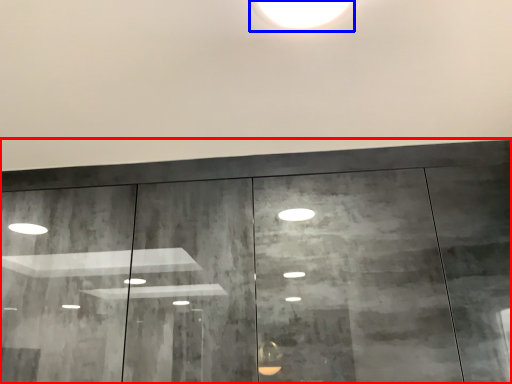
Question: Which object is further to the camera taking this photo, door (highlighted by a red box) or light (highlighted by a blue box)?

Choices:
 (A) door
 (B) light

Answer: (A)